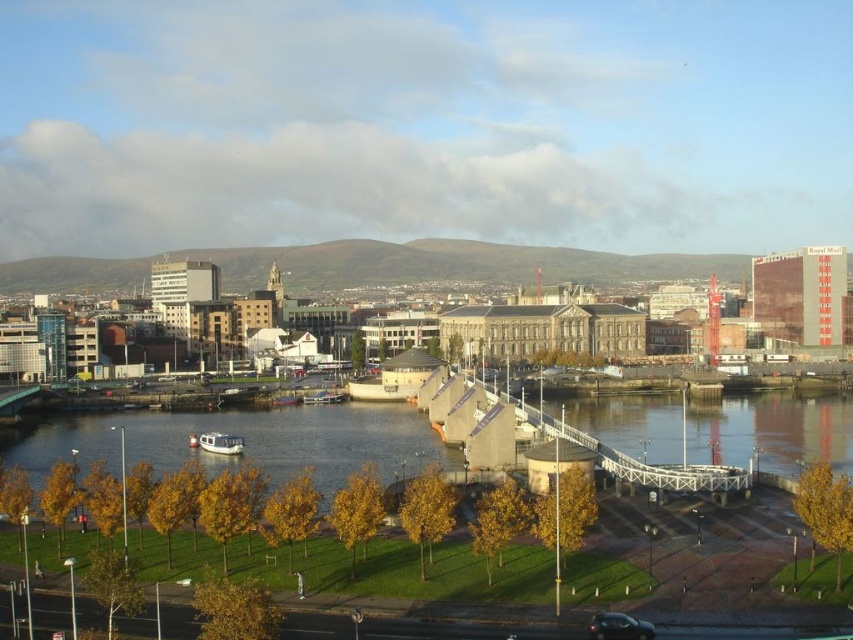
Question: Which point is farther from the camera taking this photo?

Choices:
 (A) (602, 632)
 (B) (199, 413)

Answer: (B)

Question: Which of the following is the closest to the observer?

Choices:
 (A) clear water at lower center
 (B) white wooden bridge at center

Answer: (B)

Question: Where is white wooden bridge at center located in relation to shiny black car at bottom right in the image?

Choices:
 (A) right
 (B) left

Answer: (A)

Question: Does clear water at lower center come in front of white wooden bridge at center?

Choices:
 (A) no
 (B) yes

Answer: (A)

Question: Which object is closer to the camera taking this photo?

Choices:
 (A) white wooden bridge at center
 (B) clear water at lower center

Answer: (A)

Question: Does clear water at lower center appear on the right side of shiny black car at bottom right?

Choices:
 (A) yes
 (B) no

Answer: (B)